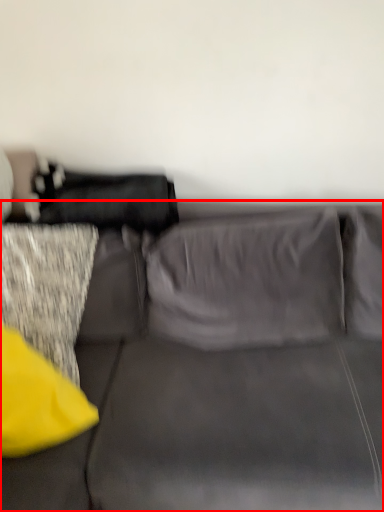
Question: From the image's perspective, what is the correct spatial relationship of studio couch (annotated by the red box) in relation to pillow?

Choices:
 (A) below
 (B) above

Answer: (B)